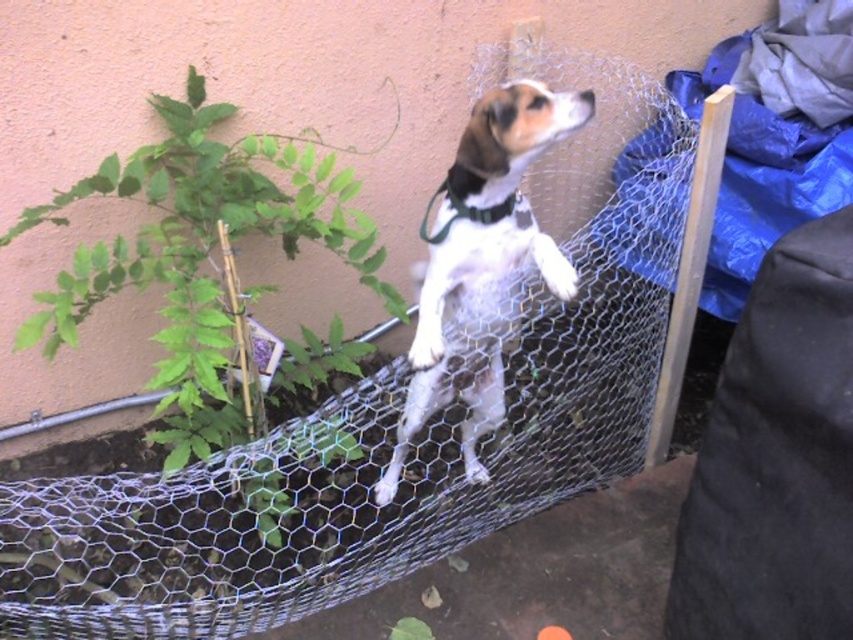
Question: Can you confirm if green leafy plant at upper left is smaller than black fabric neckband at upper center?

Choices:
 (A) yes
 (B) no

Answer: (B)

Question: Which object is positioned farthest from the green leafy plant at upper left?

Choices:
 (A) white fur dog at center
 (B) black fabric neckband at upper center

Answer: (B)

Question: Can you confirm if green leafy plant at upper left is positioned to the right of black fabric neckband at upper center?

Choices:
 (A) yes
 (B) no

Answer: (B)

Question: Which point is closer to the camera?

Choices:
 (A) green leafy plant at upper left
 (B) black fabric neckband at upper center
 (C) white fur dog at center

Answer: (C)

Question: Which of the following is the farthest from the observer?

Choices:
 (A) (311, 172)
 (B) (397, 429)

Answer: (A)

Question: Is white fur dog at center wider than black fabric neckband at upper center?

Choices:
 (A) no
 (B) yes

Answer: (B)